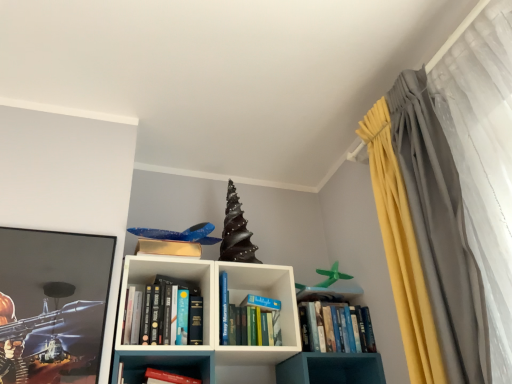
Question: In terms of size, does hardcover book at center, which appears as the second book when viewed from the left, appear bigger or smaller than hardcover book at center?

Choices:
 (A) big
 (B) small

Answer: (A)

Question: Is hardcover book at center, which is counted as the second book, starting from the right, to the left or to the right of hardcover book at center in the image?

Choices:
 (A) left
 (B) right

Answer: (A)

Question: Considering the real-world distances, which object is closest to the metallic glossy picture frame at left?

Choices:
 (A) blue hardcover book at center, placed as the 3th book when sorted from left to right
 (B) white matte bookshelf at center
 (C) hardcover books at center, placed as the 1th book when sorted from left to right
 (D) hardcover book at center
 (E) silky gray curtain at right

Answer: (C)

Question: Which object is the farthest from the hardcover book at center?

Choices:
 (A) metallic glossy picture frame at left
 (B) silky gray curtain at right
 (C) hardcover books at center, which ranks as the third book in right-to-left order
 (D) white matte bookshelf at center
 (E) blue hardcover book at center, acting as the first book starting from the right

Answer: (B)